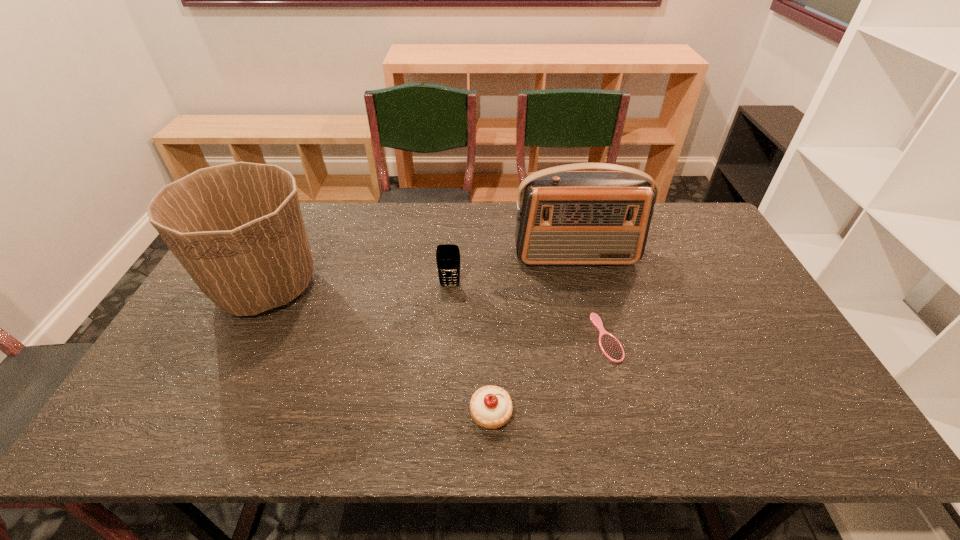
I want to click on the leftmost object, so click(237, 229).

At what (x,y) coordinates should I click in order to perform the action: click on radio receiver. Please return your answer as a coordinate pair (x, y). Looking at the image, I should click on (565, 217).

Locate an element on the screen. cellular telephone is located at coordinates (447, 255).

The image size is (960, 540). I want to click on the fourth object from right to left, so click(x=447, y=255).

The width and height of the screenshot is (960, 540). What are the coordinates of `the third object from left to right` in the screenshot? It's located at (491, 407).

You are a GUI agent. You are given a task and a screenshot of the screen. Output one action in this format:
    pyautogui.click(x=<x>, y=<y>)
    Task: Click on the fourth tallest object
    The height and width of the screenshot is (540, 960).
    Given the screenshot: What is the action you would take?
    pyautogui.click(x=491, y=407)

I want to click on the shortest object, so click(611, 347).

Where is `free space located 0.160m on the right of the flowerpot`? free space located 0.160m on the right of the flowerpot is located at coordinates (377, 287).

You are a GUI agent. You are given a task and a screenshot of the screen. Output one action in this format:
    pyautogui.click(x=<x>, y=<y>)
    Task: Click on the vacant space located 0.380m on the front-facing side of the radio receiver
    The width and height of the screenshot is (960, 540).
    Given the screenshot: What is the action you would take?
    pyautogui.click(x=604, y=372)

This screenshot has width=960, height=540. Find the location of `free region located on the screen of the cellular telephone`. free region located on the screen of the cellular telephone is located at coordinates (443, 382).